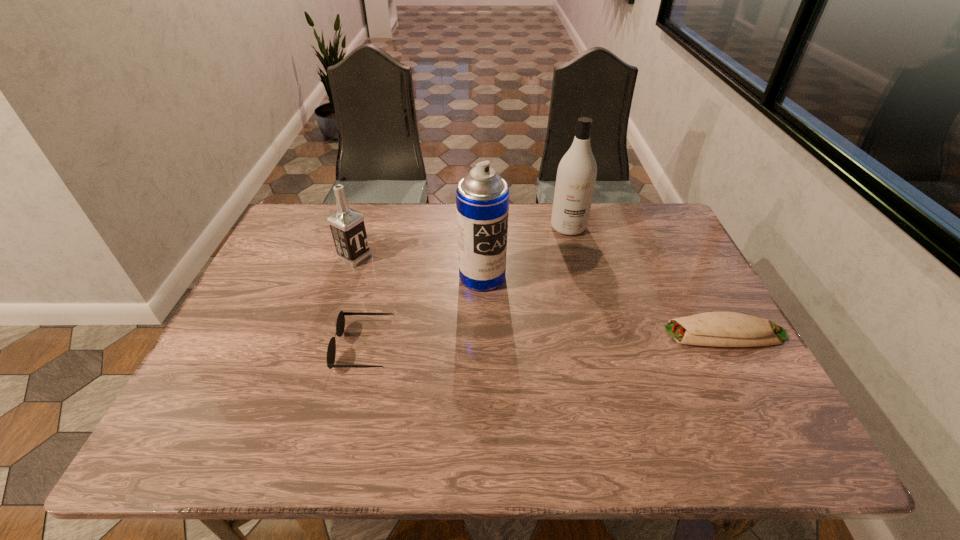
Identify the location of free spot between the burrito and the third object from left to right. (604, 305).

Find the location of `object that ranks as the fourth closest to the third shortest object`. object that ranks as the fourth closest to the third shortest object is located at coordinates (720, 329).

The width and height of the screenshot is (960, 540). Identify the location of object that stands as the second closest to the third object from right to left. (576, 176).